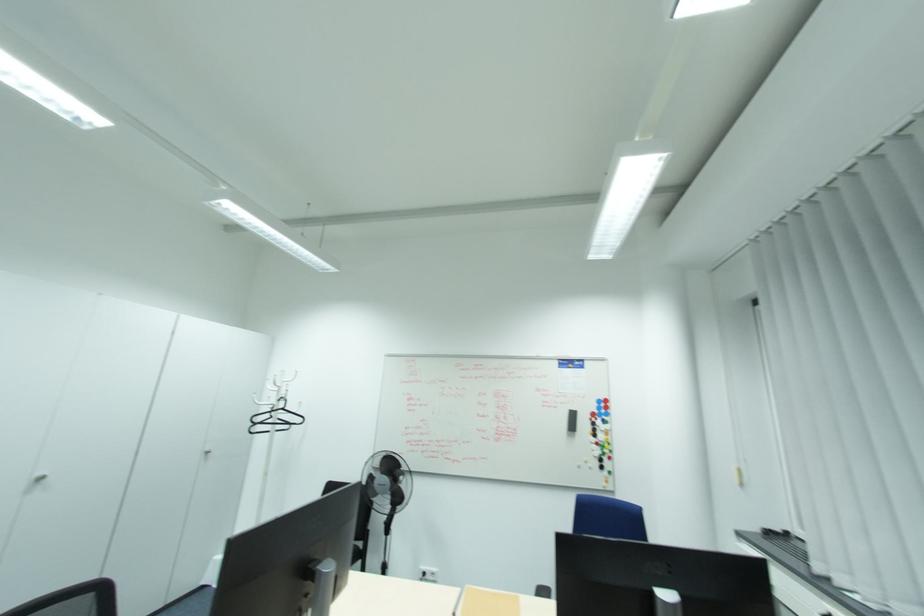
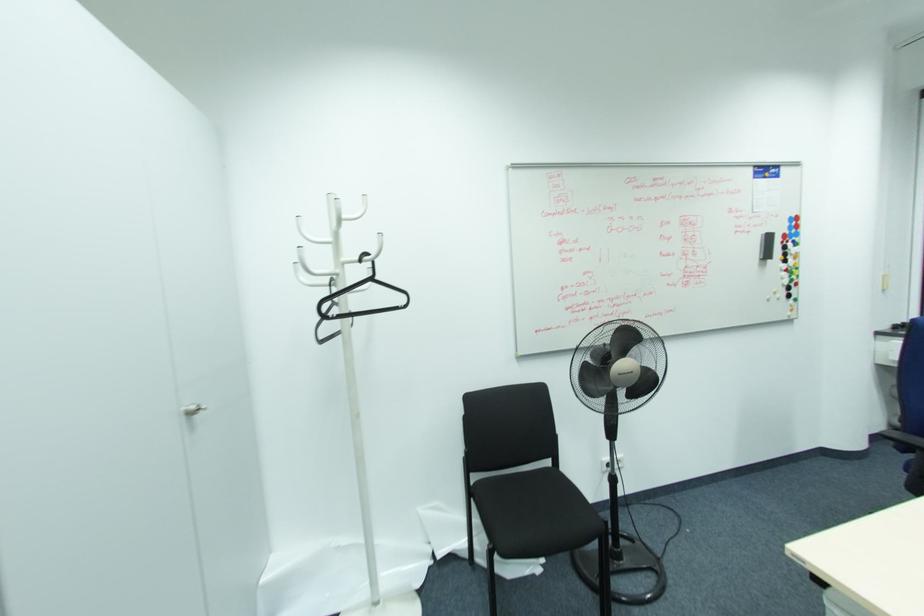
Locate, in the second image, the point that corresponds to (284,408) in the first image.

(371, 280)